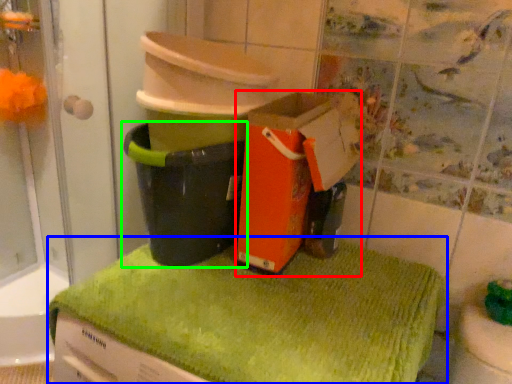
Question: Based on their relative distances, which object is farther from cardboard box (highlighted by a red box)? Choose from bath towel (highlighted by a blue box) and waste container (highlighted by a green box).

Choices:
 (A) bath towel
 (B) waste container

Answer: (A)